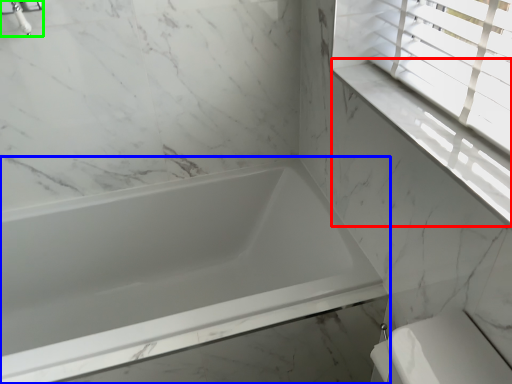
Question: Which object is positioned farthest from window sill (highlighted by a red box)? Select from bathtub (highlighted by a blue box) and faucet (highlighted by a green box).

Choices:
 (A) bathtub
 (B) faucet

Answer: (B)